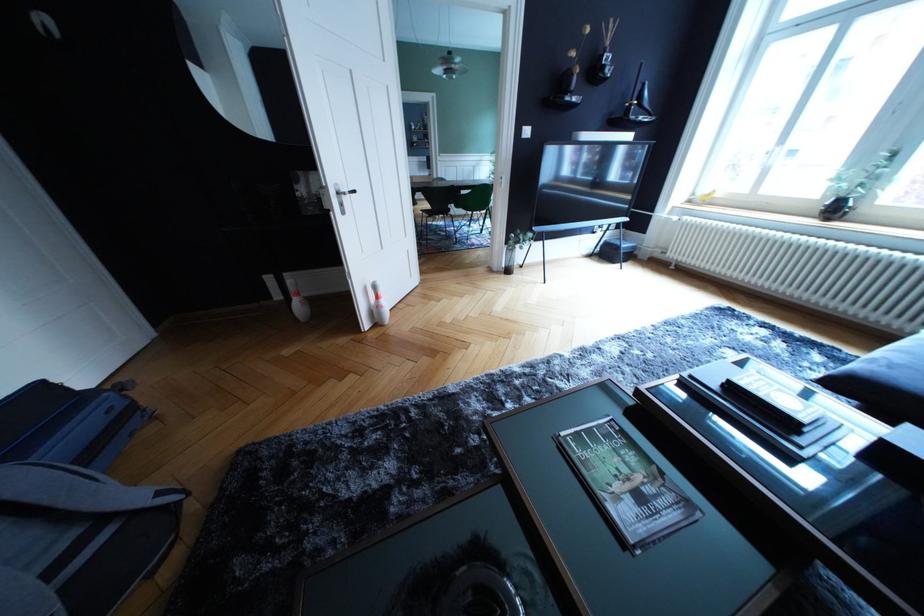
The image size is (924, 616). What do you see at coordinates (588, 184) in the screenshot? I see `a sofa sitting surface` at bounding box center [588, 184].